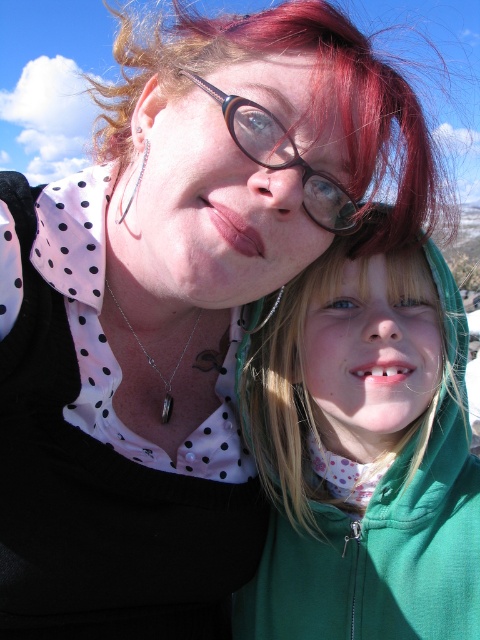
Question: Is the position of brown/black/glossy glasses at center less distant than that of silver/black stone pendant at center?

Choices:
 (A) yes
 (B) no

Answer: (A)

Question: Among these points, which one is farthest from the camera?

Choices:
 (A) (168, 385)
 (B) (338, 253)
 (C) (156, 67)

Answer: (A)

Question: Is green fleece jacket at lower right below blonde hair at upper right?

Choices:
 (A) yes
 (B) no

Answer: (A)

Question: From the image, what is the correct spatial relationship of blonde hair at upper right in relation to silver/black stone pendant at center?

Choices:
 (A) left
 (B) right

Answer: (A)

Question: Estimate the real-world distances between objects in this image. Which object is closer to the blonde hair at upper right?

Choices:
 (A) silver/black stone pendant at center
 (B) brown/black/glossy glasses at center
 (C) green fleece jacket at lower right

Answer: (C)

Question: Which point is farther to the camera?

Choices:
 (A) green fleece jacket at lower right
 (B) silver/black stone pendant at center
 (C) blonde hair at upper right

Answer: (B)